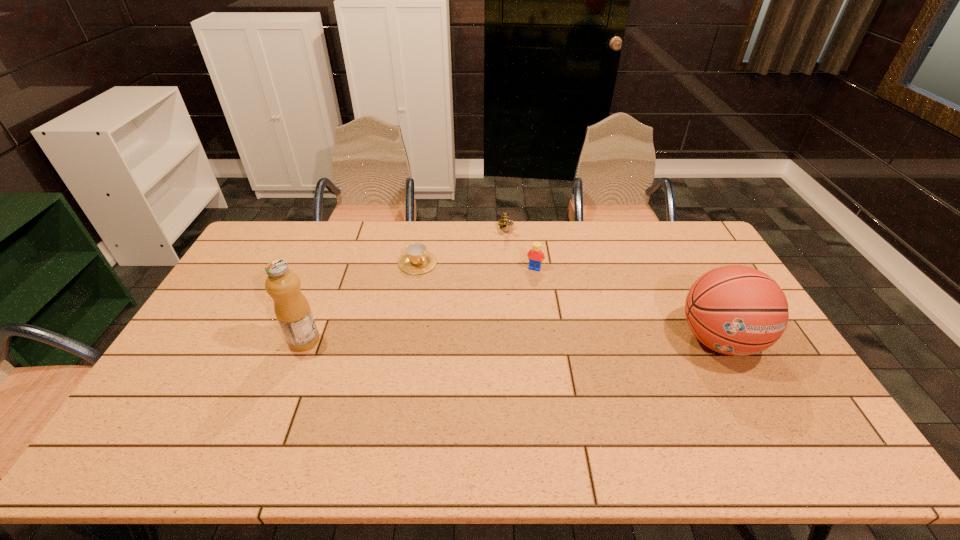
Locate an element on the screen. The image size is (960, 540). free point between the basketball and the fourth object from left to right is located at coordinates (627, 304).

Identify the location of empty space between the rightmost object and the cup. (568, 301).

Locate an element on the screen. The height and width of the screenshot is (540, 960). empty space that is in between the rightmost object and the second object from left to right is located at coordinates (568, 301).

Where is `free space between the snail and the cup`? This screenshot has height=540, width=960. free space between the snail and the cup is located at coordinates (462, 247).

This screenshot has height=540, width=960. Identify the location of empty space between the fourth object from left to right and the basketball. (627, 304).

The image size is (960, 540). I want to click on vacant region between the second object from right to left and the fruit juice, so click(x=420, y=305).

Identify the location of vacant space that's between the fruit juice and the Lego. Image resolution: width=960 pixels, height=540 pixels. point(420,305).

The width and height of the screenshot is (960, 540). I want to click on empty location between the cup and the fruit juice, so click(361, 302).

Where is `unoccupied area between the fruit juice and the fourth object from right to left`? The height and width of the screenshot is (540, 960). unoccupied area between the fruit juice and the fourth object from right to left is located at coordinates pos(361,302).

What are the coordinates of `object that is the fourth closest to the second object from right to left` in the screenshot? It's located at (291, 307).